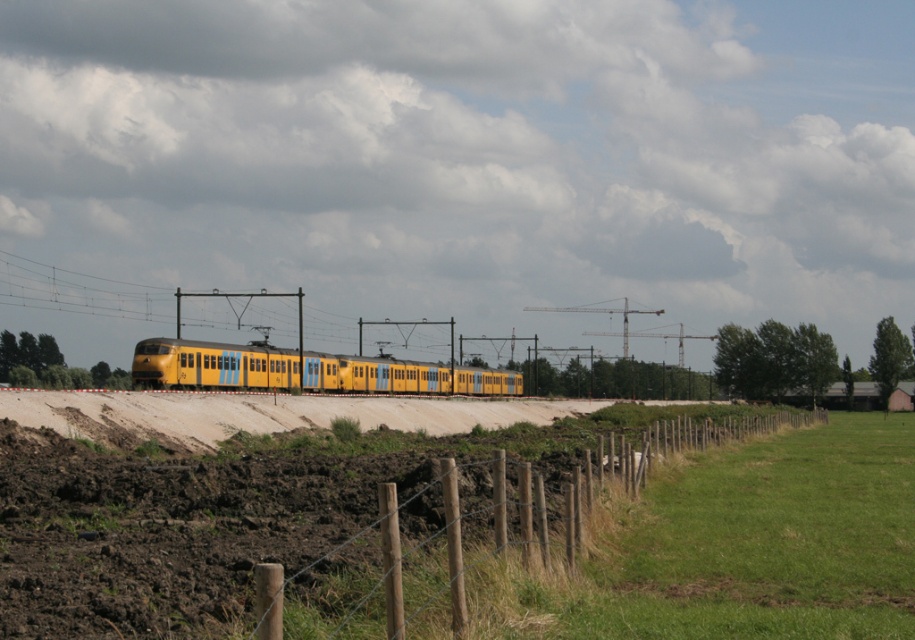
Question: Which object appears closest to the camera in this image?

Choices:
 (A) green grass at lower right
 (B) wooden post wire fence at lower right
 (C) yellow matte train at center

Answer: (B)

Question: Among these objects, which one is nearest to the camera?

Choices:
 (A) wooden post wire fence at lower right
 (B) yellow matte train at center

Answer: (A)

Question: Can you confirm if green grass at lower right is smaller than wooden post wire fence at lower right?

Choices:
 (A) yes
 (B) no

Answer: (A)

Question: Where is green grass at lower right located in relation to yellow matte train at center in the image?

Choices:
 (A) left
 (B) right

Answer: (B)

Question: Is green grass at lower right further to camera compared to wooden post wire fence at lower right?

Choices:
 (A) no
 (B) yes

Answer: (B)

Question: Based on their relative distances, which object is farther from the yellow matte train at center?

Choices:
 (A) wooden post wire fence at lower right
 (B) green grass at lower right

Answer: (B)